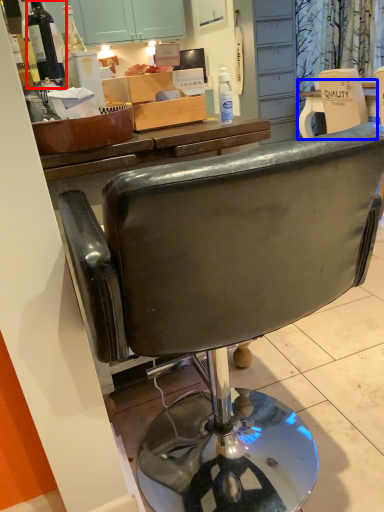
Question: Which point is closer to the camera, bottle (highlighted by a red box) or desk (highlighted by a blue box)?

Choices:
 (A) bottle
 (B) desk

Answer: (A)